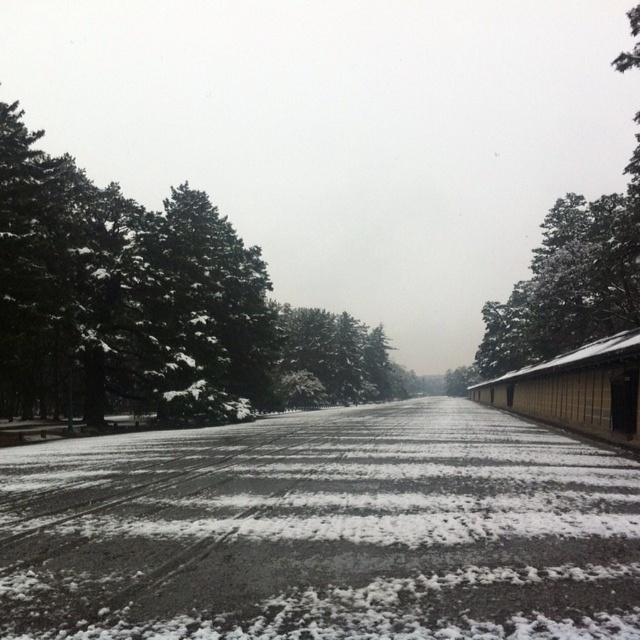
Does green snow-covered trees at left have a greater width compared to snow-covered evergreen at center?

Indeed, green snow-covered trees at left has a greater width compared to snow-covered evergreen at center.

Is green snow-covered trees at left to the left of snow-covered evergreen at center from the viewer's perspective?

Indeed, green snow-covered trees at left is positioned on the left side of snow-covered evergreen at center.

Is point (58, 180) in front of point (328, 371)?

Yes, it is in front of point (328, 371).

I want to click on green snow-covered trees at left, so pos(154,307).

Does point (512, 362) come in front of point (330, 400)?

Yes.

Locate an element on the screen. The height and width of the screenshot is (640, 640). snow-covered tree at upper right is located at coordinates (570, 280).

Can you confirm if white powdery snow at center is positioned to the right of green snow-covered trees at left?

Correct, you'll find white powdery snow at center to the right of green snow-covered trees at left.

The height and width of the screenshot is (640, 640). What do you see at coordinates (323, 531) in the screenshot?
I see `white powdery snow at center` at bounding box center [323, 531].

The width and height of the screenshot is (640, 640). In order to click on white powdery snow at center in this screenshot , I will do `click(323, 531)`.